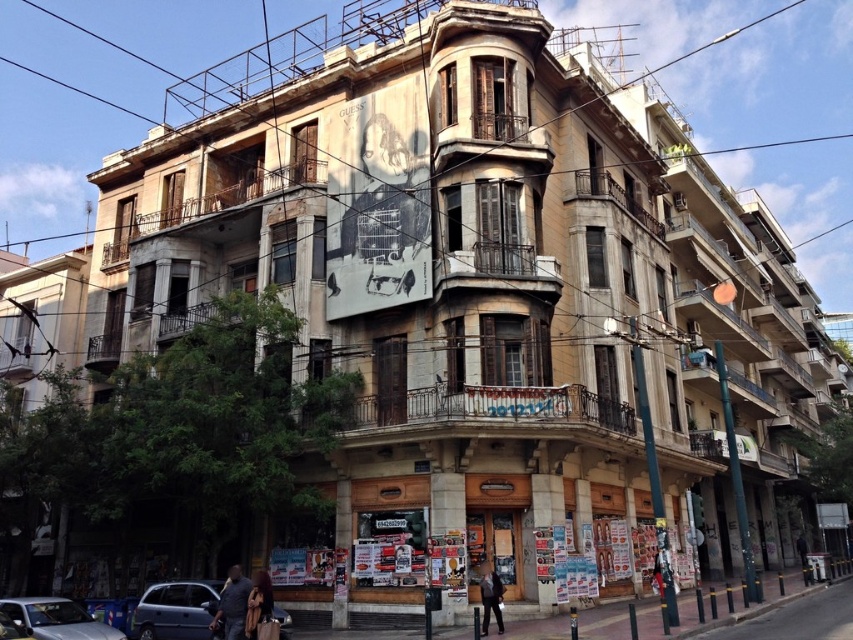
In the scene shown: Can you confirm if matte blue van at lower left is shorter than blue metallic car at lower left?

Yes.

Can you confirm if matte blue van at lower left is wider than blue metallic car at lower left?

No, matte blue van at lower left is not wider than blue metallic car at lower left.

What are the coordinates of `matte blue van at lower left` in the screenshot? It's located at (177, 611).